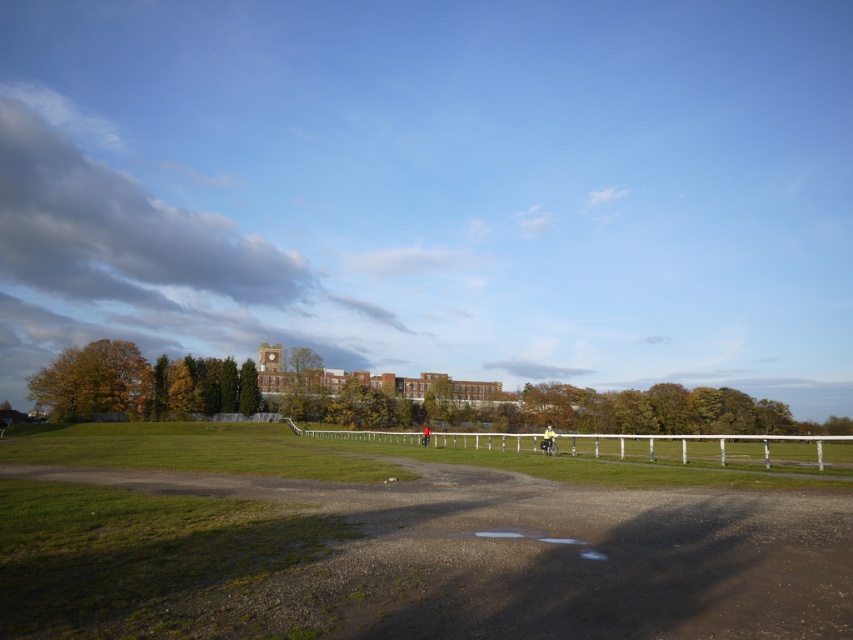
Is point (331, 499) less distant than point (693, 451)?

Yes.

Which is behind, point (123, 624) or point (798, 467)?

Positioned behind is point (798, 467).

The image size is (853, 640). Find the location of `dirt track at lower center`. dirt track at lower center is located at coordinates (421, 557).